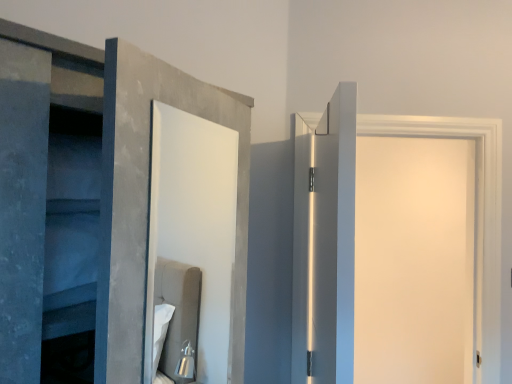
Question: Considering the relative sizes of white matte door at right, the 2th door from the left, and white glossy door at upper right, positioned as the first door in left-to-right order, in the image provided, is white matte door at right, the 2th door from the left, wider than white glossy door at upper right, positioned as the first door in left-to-right order,?

Choices:
 (A) no
 (B) yes

Answer: (B)

Question: Considering the relative positions of white matte door at right, which is the second door from front to back, and white glossy door at upper right, which is counted as the 2th door, starting from the back, in the image provided, is white matte door at right, which is the second door from front to back, behind white glossy door at upper right, which is counted as the 2th door, starting from the back,?

Choices:
 (A) yes
 (B) no

Answer: (A)

Question: Can you confirm if white matte door at right, arranged as the 1th door when viewed from the right, is taller than white glossy door at upper right, positioned as the first door in left-to-right order?

Choices:
 (A) no
 (B) yes

Answer: (B)

Question: Can we say white matte door at right, arranged as the 1th door when viewed from the right, lies outside white glossy door at upper right, positioned as the first door in left-to-right order?

Choices:
 (A) no
 (B) yes

Answer: (B)

Question: Can you confirm if white matte door at right, which is the second door from front to back, is bigger than white glossy door at upper right, placed as the first door when sorted from front to back?

Choices:
 (A) yes
 (B) no

Answer: (A)

Question: Is white matte door at right, the 2th door from the left, directly adjacent to white glossy door at upper right, placed as the first door when sorted from front to back?

Choices:
 (A) yes
 (B) no

Answer: (B)

Question: Can you confirm if white glossy door at upper right, placed as the first door when sorted from front to back, is taller than white matte door at right, which ranks as the first door in back-to-front order?

Choices:
 (A) yes
 (B) no

Answer: (B)

Question: Is white glossy door at upper right, which ranks as the 2th door in right-to-left order, at the right side of white matte door at right, the 2th door from the left?

Choices:
 (A) no
 (B) yes

Answer: (A)

Question: From a real-world perspective, is white glossy door at upper right, which is counted as the 2th door, starting from the back, over white matte door at right, which ranks as the first door in back-to-front order?

Choices:
 (A) no
 (B) yes

Answer: (A)

Question: Is white glossy door at upper right, which is counted as the 2th door, starting from the back, smaller than white matte door at right, the 2th door from the left?

Choices:
 (A) no
 (B) yes

Answer: (B)

Question: Is white glossy door at upper right, which is counted as the 2th door, starting from the back, next to white matte door at right, which ranks as the first door in back-to-front order?

Choices:
 (A) yes
 (B) no

Answer: (B)

Question: From the image's perspective, does white glossy door at upper right, placed as the first door when sorted from front to back, appear higher than white matte door at right, which ranks as the first door in back-to-front order?

Choices:
 (A) no
 (B) yes

Answer: (B)

Question: Is point (394, 231) closer or farther from the camera than point (298, 374)?

Choices:
 (A) farther
 (B) closer

Answer: (A)